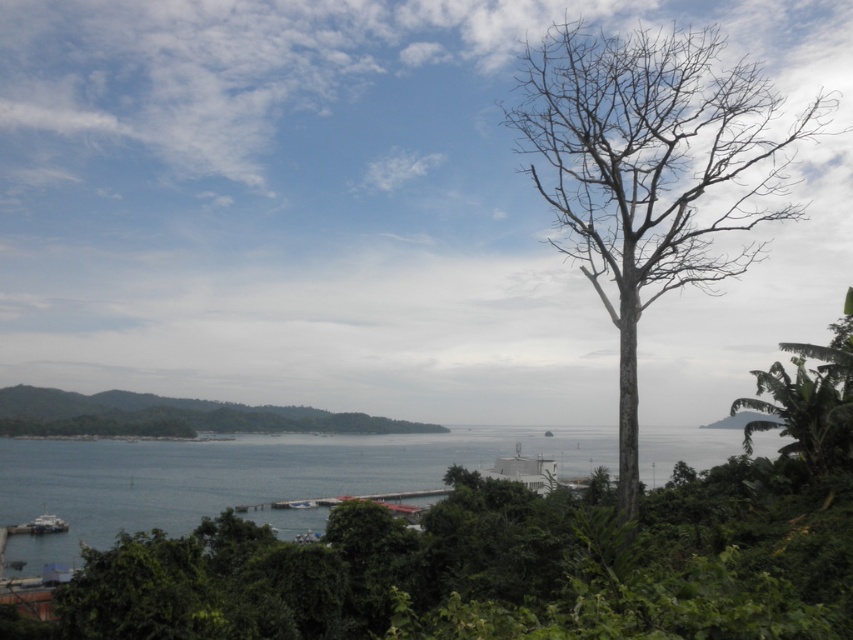
Does point (93, 419) come farther from viewer compared to point (801, 394)?

Yes.

Where is `green leafy tree at lower left`? The height and width of the screenshot is (640, 853). green leafy tree at lower left is located at coordinates (173, 416).

Locate an element on the screen. The image size is (853, 640). green leafy tree at lower left is located at coordinates (173, 416).

Which is above, bare wood tree at right or green leafy tree at right?

bare wood tree at right is above.

Does point (558, 35) lie in front of point (793, 401)?

That is False.

Between point (566, 177) and point (793, 420), which one is positioned behind?

Positioned behind is point (793, 420).

Find the location of `bare wood tree at right`. bare wood tree at right is located at coordinates (653, 170).

Which is behind, point (260, 486) or point (795, 448)?

The point (260, 486) is more distant.

Does blue water at center have a lesser height compared to green leafy tree at right?

No, blue water at center is not shorter than green leafy tree at right.

Where is `blue water at center`? blue water at center is located at coordinates (241, 477).